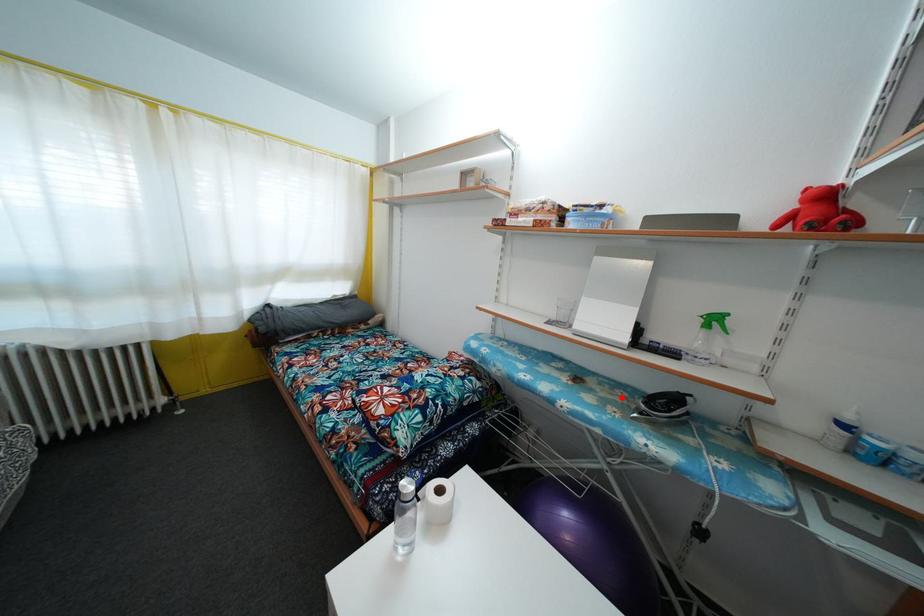
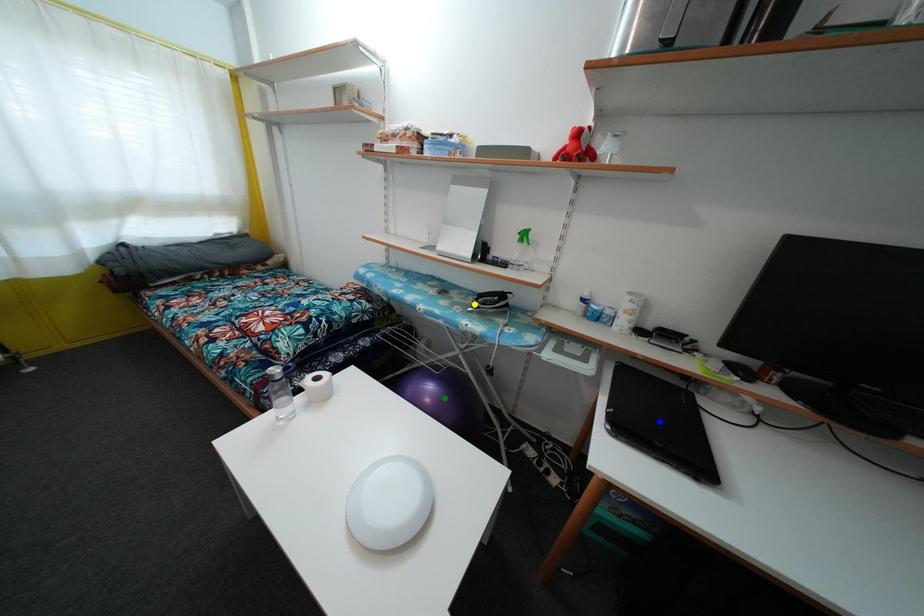
Question: I am providing you with two images of the same scene from different viewpoints. A red point is marked on the first image. You are given multiple points on the second image. Which point in image 2 is actually the same real-world point as the red point in image 1?

Choices:
 (A) blue point
 (B) green point
 (C) yellow point

Answer: (C)